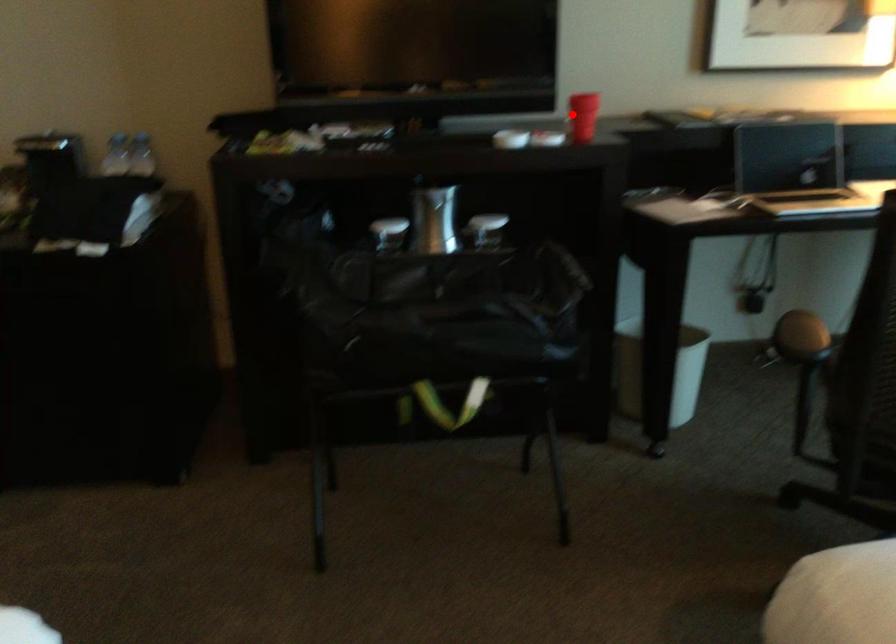
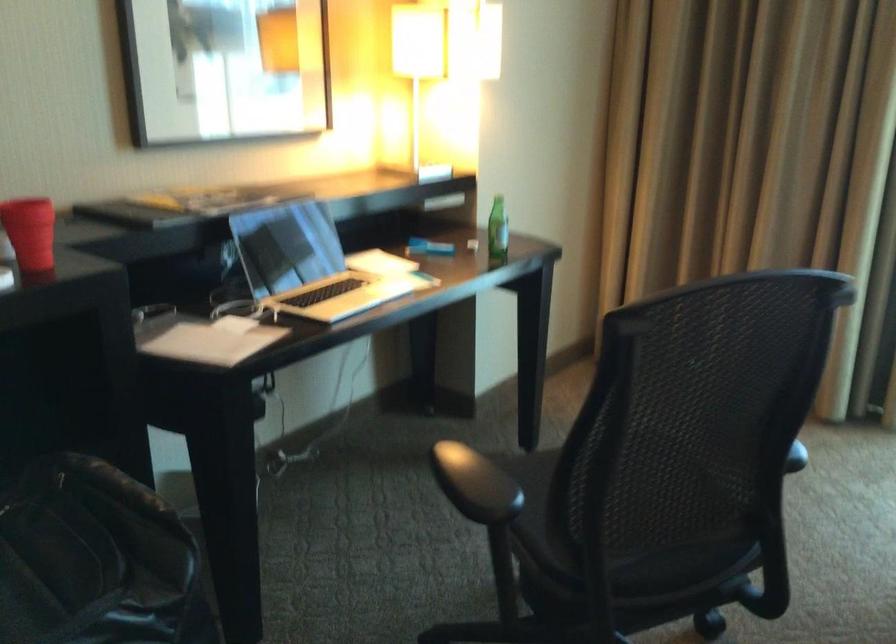
The point at the highlighted location is marked in the first image. Where is the corresponding point in the second image?

(30, 232)